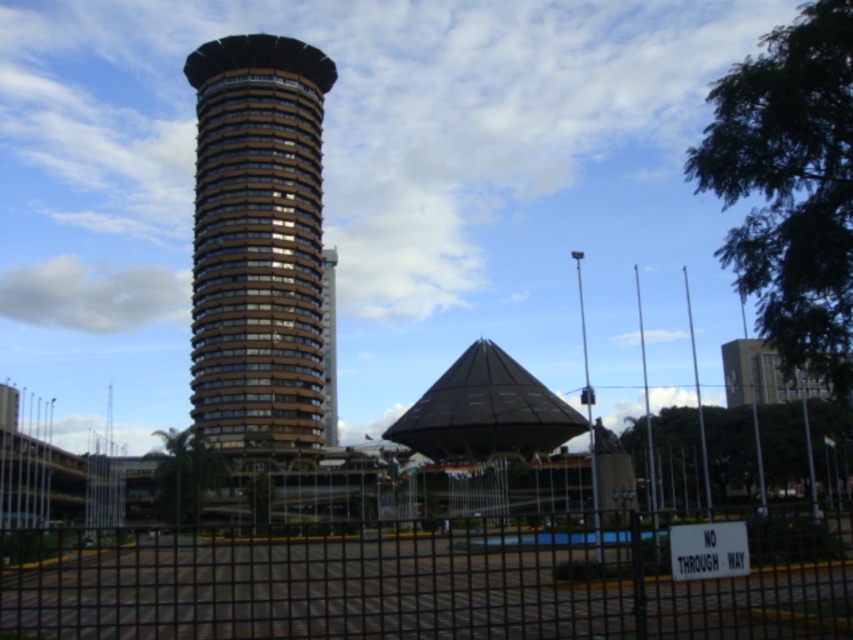
Which is more to the right, black metal fence at lower center or brown glass tower at center?

black metal fence at lower center is more to the right.

Which is behind, point (553, 538) or point (256, 168)?

The point (256, 168) is behind.

At what (x,y) coordinates should I click in order to perform the action: click on black metal fence at lower center. Please return your answer as a coordinate pair (x, y). Image resolution: width=853 pixels, height=640 pixels. Looking at the image, I should click on (422, 582).